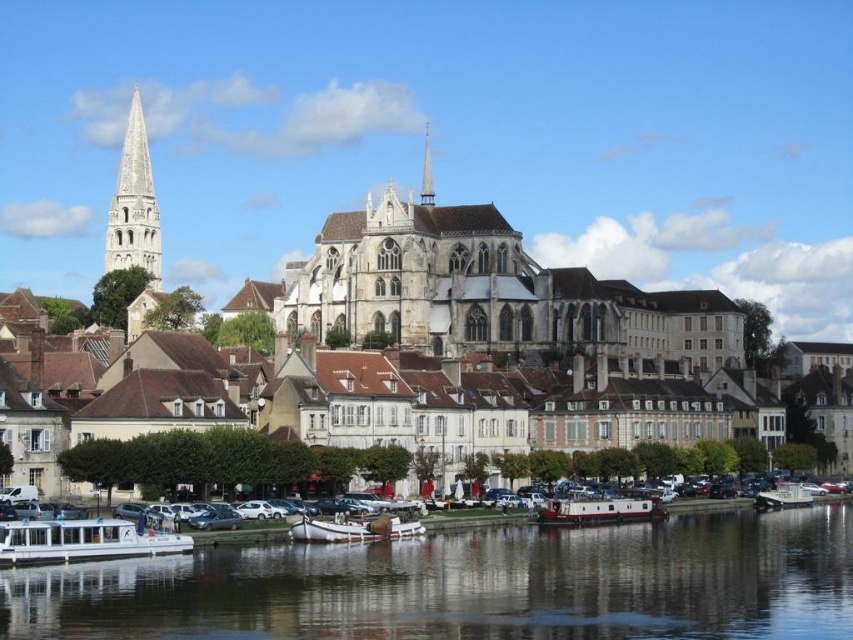
Between white matte boat at lower left and smooth white spire at center, which one has more height?

smooth white spire at center

Is point (16, 529) positioned before point (431, 200)?

Yes, it is in front of point (431, 200).

Find the location of a particular element. white matte boat at lower left is located at coordinates coord(82,541).

Which is above, white stone buildings at center or white matte boat at lower left?

white stone buildings at center

Does point (691, 320) lie in front of point (38, 545)?

No, it is behind (38, 545).

What are the coordinates of `white stone buildings at center` in the screenshot? It's located at (483, 294).

The height and width of the screenshot is (640, 853). What are the coordinates of `white stone buildings at center` in the screenshot? It's located at (483, 294).

Can you confirm if metallic gray boat at lower right is positioned above smooth white spire at center?

Actually, metallic gray boat at lower right is below smooth white spire at center.

In the scene shown: Between metallic gray boat at lower right and smooth white spire at center, which one has more height?

smooth white spire at center is taller.

Is point (802, 486) farther from viewer compared to point (427, 154)?

No, it is not.

Identify the location of metallic gray boat at lower right. (782, 497).